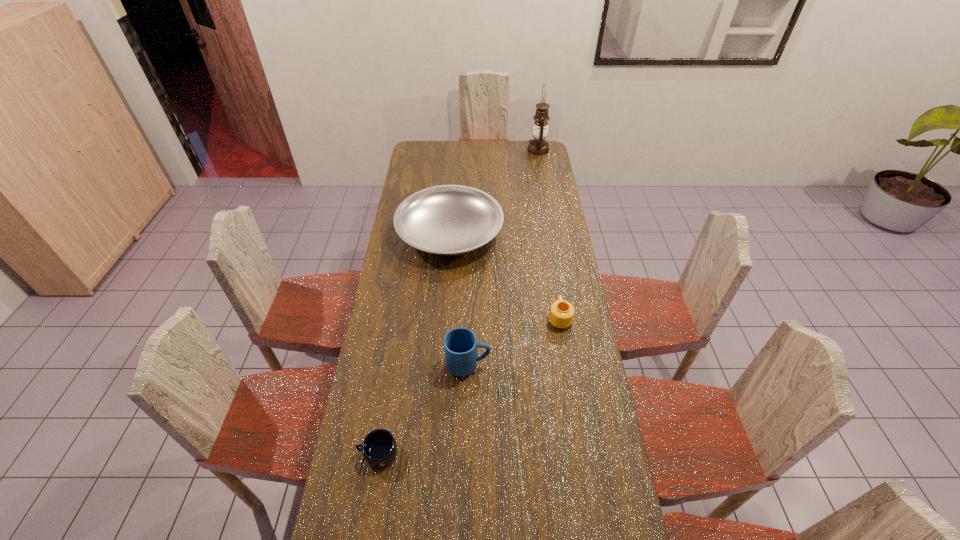
What are the coordinates of `object that is at the far right corner` in the screenshot? It's located at (538, 146).

The image size is (960, 540). In order to click on blank space at the far edge of the desktop in this screenshot , I will do `click(479, 143)`.

Find the location of a particular element. free space at the left edge of the desktop is located at coordinates (372, 484).

The height and width of the screenshot is (540, 960). In the image, there is a desktop. Identify the location of vacant space at the right edge. (577, 443).

In the image, there is a desktop. Find the location of `vacant space at the far right corner`. vacant space at the far right corner is located at coordinates (529, 152).

You are a GUI agent. You are given a task and a screenshot of the screen. Output one action in this format:
    pyautogui.click(x=<x>, y=<y>)
    Task: Click on the vacant area between the fourth nearest object and the fourth farthest object
    
    Given the screenshot: What is the action you would take?
    pyautogui.click(x=459, y=299)

Image resolution: width=960 pixels, height=540 pixels. In order to click on vacant area that lies between the second shortest mug and the leftmost mug in this screenshot , I will do `click(468, 386)`.

Identify the location of vacant point located between the shortest mug and the tallest mug. (423, 409).

Where is `vacant area that lies between the shortest mug and the second farthest object`? The height and width of the screenshot is (540, 960). vacant area that lies between the shortest mug and the second farthest object is located at coordinates click(414, 343).

Where is `free space between the shortest mug and the second nearest object`? This screenshot has width=960, height=540. free space between the shortest mug and the second nearest object is located at coordinates (423, 409).